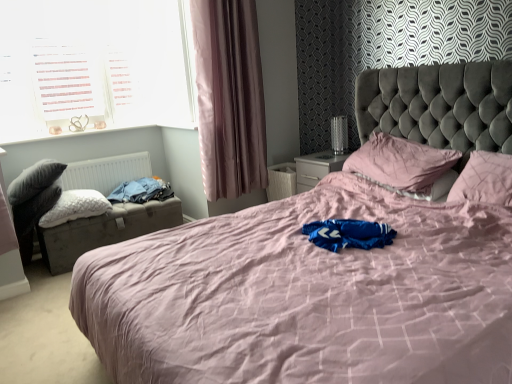
Question: Should I look upward or downward to see white fluffy pillow at left, which appears as the 1th pillow when viewed from the left?

Choices:
 (A) down
 (B) up

Answer: (A)

Question: From the image's perspective, does white plastic window at upper left appear lower than pink fabric bed at center?

Choices:
 (A) yes
 (B) no

Answer: (B)

Question: From the image's perspective, is white plastic window at upper left located above pink fabric bed at center?

Choices:
 (A) no
 (B) yes

Answer: (B)

Question: Is white plastic window at upper left aimed at pink fabric bed at center?

Choices:
 (A) yes
 (B) no

Answer: (A)

Question: Considering the relative sizes of white plastic window at upper left and pink fabric bed at center in the image provided, is white plastic window at upper left shorter than pink fabric bed at center?

Choices:
 (A) yes
 (B) no

Answer: (A)

Question: Could pink fabric bed at center be considered to be inside white plastic window at upper left?

Choices:
 (A) yes
 (B) no

Answer: (B)

Question: Is white plastic window at upper left far away from pink fabric bed at center?

Choices:
 (A) no
 (B) yes

Answer: (B)

Question: Is white matte radiator at left behind blue fabric at left?

Choices:
 (A) no
 (B) yes

Answer: (B)

Question: Is white matte radiator at left wider than blue fabric at left?

Choices:
 (A) yes
 (B) no

Answer: (B)

Question: Is blue fabric at left completely or partially inside white matte radiator at left?

Choices:
 (A) no
 (B) yes

Answer: (A)

Question: Is white matte radiator at left to the left of blue fabric at left from the viewer's perspective?

Choices:
 (A) no
 (B) yes

Answer: (B)

Question: Is white matte radiator at left oriented towards blue fabric at left?

Choices:
 (A) yes
 (B) no

Answer: (A)

Question: Is white matte radiator at left at the right side of blue fabric at left?

Choices:
 (A) yes
 (B) no

Answer: (B)

Question: Is leatherette storage trunk at left thinner than dark grey fabric swivel chair at left?

Choices:
 (A) yes
 (B) no

Answer: (B)